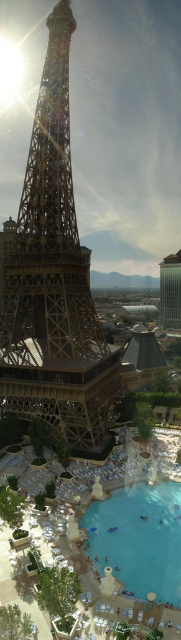
Question: Which is farther from the clear blue water at lower center?

Choices:
 (A) green glass tower at upper center
 (B) golden metallic eiffel tower at center

Answer: (A)

Question: Among these objects, which one is nearest to the camera?

Choices:
 (A) clear blue water at lower center
 (B) golden metallic eiffel tower at center

Answer: (A)

Question: Can you confirm if golden metallic eiffel tower at center is positioned above clear blue water at lower center?

Choices:
 (A) yes
 (B) no

Answer: (A)

Question: Is golden metallic eiffel tower at center below green glass tower at upper center?

Choices:
 (A) yes
 (B) no

Answer: (B)

Question: Which of the following is the closest to the observer?

Choices:
 (A) (171, 266)
 (B) (68, 192)
 (C) (146, 572)

Answer: (C)

Question: Can you confirm if golden metallic eiffel tower at center is positioned to the left of clear blue water at lower center?

Choices:
 (A) no
 (B) yes

Answer: (B)